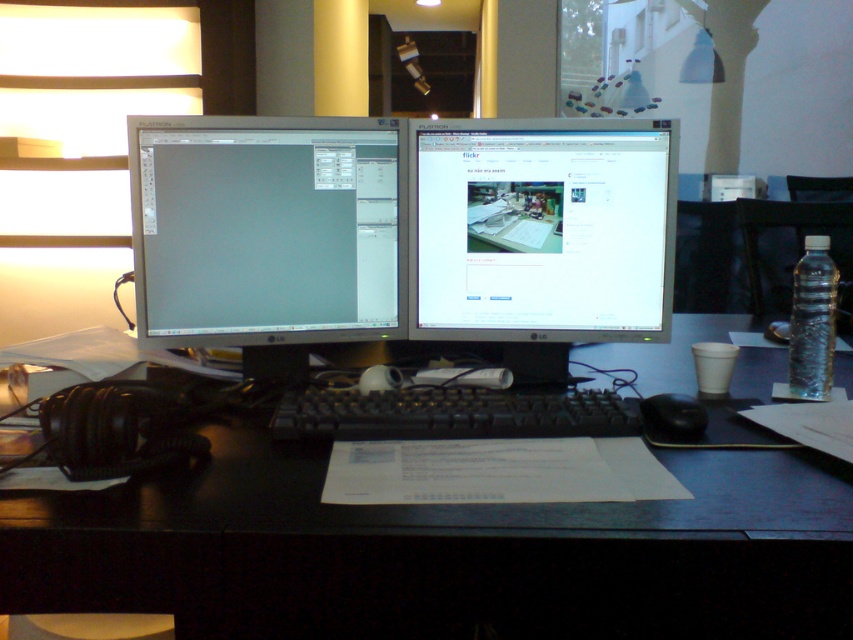
Question: Is the position of black plastic computer desk at center more distant than that of black plastic keyboard at center?

Choices:
 (A) yes
 (B) no

Answer: (B)

Question: Based on their relative distances, which object is farther from the black plastic computer desk at center?

Choices:
 (A) matte black monitor at left
 (B) black matte mouse at lower right
 (C) black plastic keyboard at center
 (D) white glossy monitor at center

Answer: (D)

Question: Does black plastic computer desk at center appear on the right side of white glossy monitor at center?

Choices:
 (A) yes
 (B) no

Answer: (B)

Question: Among these objects, which one is farthest from the camera?

Choices:
 (A) black matte mouse at lower right
 (B) black plastic computer desk at center
 (C) black plastic keyboard at center
 (D) white glossy monitor at center

Answer: (D)

Question: Which point is closer to the camera taking this photo?

Choices:
 (A) (709, 472)
 (B) (521, 198)
 (C) (207, 211)

Answer: (A)

Question: Does matte black monitor at left appear under black plastic keyboard at center?

Choices:
 (A) yes
 (B) no

Answer: (B)